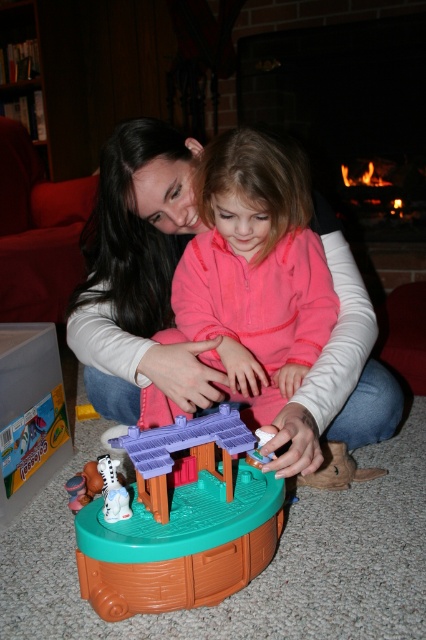
Based on the scene described, which object occupies a larger area in the image? Please choose between the brick fireplace at upper center and the white matte plush toy at lower left.

The brick fireplace at upper center is bigger than the white matte plush toy at lower left, so the brick fireplace at upper center occupies a larger area in the image.

In the cozy living room scene, there is a brown plastic playset at center and a white matte plush toy at lower left. Which object is taller?

The brown plastic playset at center is taller than the white matte plush toy at lower left.

You are a parent trying to organize the living room. You want to place the brown plastic playset at center on top of the white matte plush toy at lower left. Is this possible based on their current positions?

The brown plastic playset at center is currently below the white matte plush toy at lower left, so placing the playset on top would require moving the plush toy out of the way first.